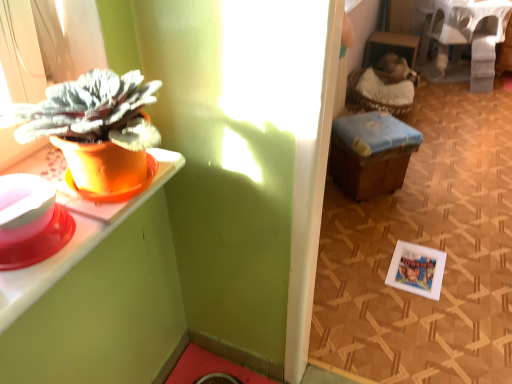
Question: Is white matte picture frame at lower right thinner than white fabric-covered table at upper right?

Choices:
 (A) no
 (B) yes

Answer: (B)

Question: Is white matte picture frame at lower right in front of white fabric-covered table at upper right?

Choices:
 (A) yes
 (B) no

Answer: (A)

Question: From a real-world perspective, is white matte picture frame at lower right located higher than white fabric-covered table at upper right?

Choices:
 (A) no
 (B) yes

Answer: (A)

Question: Does white matte picture frame at lower right come behind white fabric-covered table at upper right?

Choices:
 (A) yes
 (B) no

Answer: (B)

Question: Is white matte picture frame at lower right positioned with its back to white fabric-covered table at upper right?

Choices:
 (A) yes
 (B) no

Answer: (B)

Question: Can you confirm if white matte picture frame at lower right is smaller than white fabric-covered table at upper right?

Choices:
 (A) yes
 (B) no

Answer: (A)

Question: Does wooden stool at center have a lesser width compared to orange matte pot at left?

Choices:
 (A) no
 (B) yes

Answer: (A)

Question: Considering the relative sizes of wooden stool at center and orange matte pot at left in the image provided, is wooden stool at center taller than orange matte pot at left?

Choices:
 (A) yes
 (B) no

Answer: (A)

Question: Can you confirm if wooden stool at center is wider than orange matte pot at left?

Choices:
 (A) yes
 (B) no

Answer: (A)

Question: Does wooden stool at center come in front of orange matte pot at left?

Choices:
 (A) yes
 (B) no

Answer: (B)

Question: Is wooden stool at center far from orange matte pot at left?

Choices:
 (A) yes
 (B) no

Answer: (A)

Question: Is wooden stool at center outside orange matte pot at left?

Choices:
 (A) yes
 (B) no

Answer: (A)

Question: Can you confirm if orange matte pot at left is thinner than wooden stool at center?

Choices:
 (A) no
 (B) yes

Answer: (B)